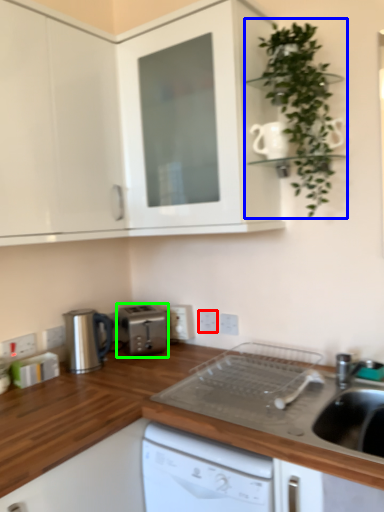
Question: Considering the real-world distances, which object is closest to electric outlet (highlighted by a red box)? houseplant (highlighted by a blue box) or kitchen appliance (highlighted by a green box).

Choices:
 (A) houseplant
 (B) kitchen appliance

Answer: (B)